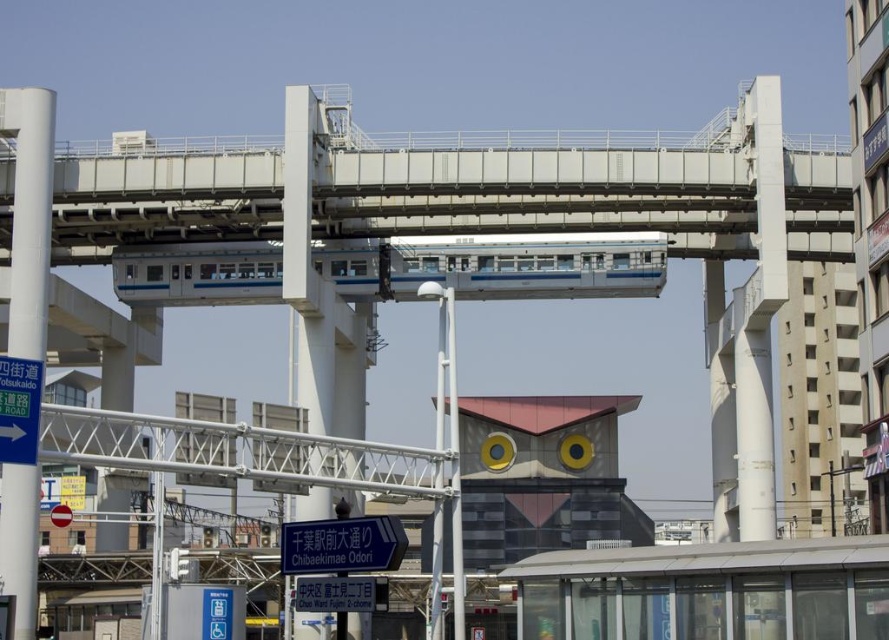
Is blue plastic street sign at center to the right of blue plastic sign at center from the viewer's perspective?

Correct, you'll find blue plastic street sign at center to the right of blue plastic sign at center.

Based on the photo, who is positioned more to the right, blue plastic street sign at center or blue plastic sign at center?

From the viewer's perspective, blue plastic street sign at center appears more on the right side.

Where is `blue plastic street sign at center`? blue plastic street sign at center is located at coordinates (342, 545).

You are a GUI agent. You are given a task and a screenshot of the screen. Output one action in this format:
    pyautogui.click(x=<x>, y=<y>)
    Task: Click on the blue plastic street sign at center
    
    Given the screenshot: What is the action you would take?
    pyautogui.click(x=342, y=545)

Find the location of a particular element. Image resolution: width=889 pixels, height=640 pixels. white glossy pole at left is located at coordinates (29, 214).

In the scene shown: Is white glossy pole at left to the left of blue plastic street sign at center from the viewer's perspective?

Correct, you'll find white glossy pole at left to the left of blue plastic street sign at center.

Describe the element at coordinates (29, 214) in the screenshot. The width and height of the screenshot is (889, 640). I see `white glossy pole at left` at that location.

Where is `white glossy pole at left`? The height and width of the screenshot is (640, 889). white glossy pole at left is located at coordinates (29, 214).

Does white metallic overpass at center appear over blue plastic sign at center?

Correct, white metallic overpass at center is located above blue plastic sign at center.

The height and width of the screenshot is (640, 889). In order to click on white metallic overpass at center in this screenshot , I will do `click(542, 193)`.

Image resolution: width=889 pixels, height=640 pixels. I want to click on white metallic overpass at center, so click(542, 193).

Locate an element on the screen. The height and width of the screenshot is (640, 889). white metallic overpass at center is located at coordinates (542, 193).